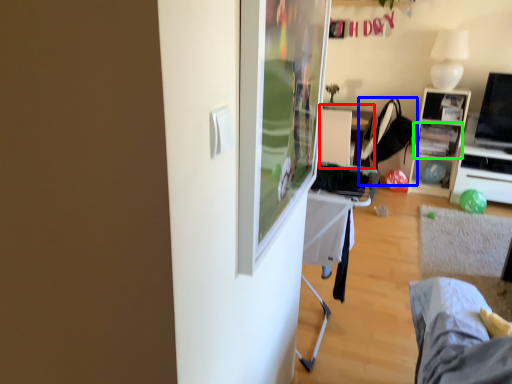
Question: Estimate the real-world distances between objects in this image. Which object is closer to table (highlighted by a red box), chair (highlighted by a blue box) or shelf (highlighted by a green box)?

Choices:
 (A) chair
 (B) shelf

Answer: (A)